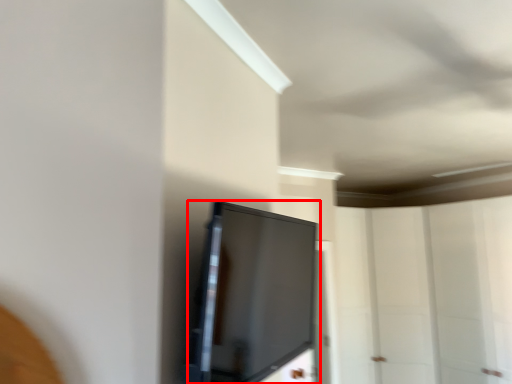
Question: Considering the relative positions of screen (annotated by the red box) and glass door in the image provided, where is screen (annotated by the red box) located with respect to the staircase?

Choices:
 (A) left
 (B) right

Answer: (A)